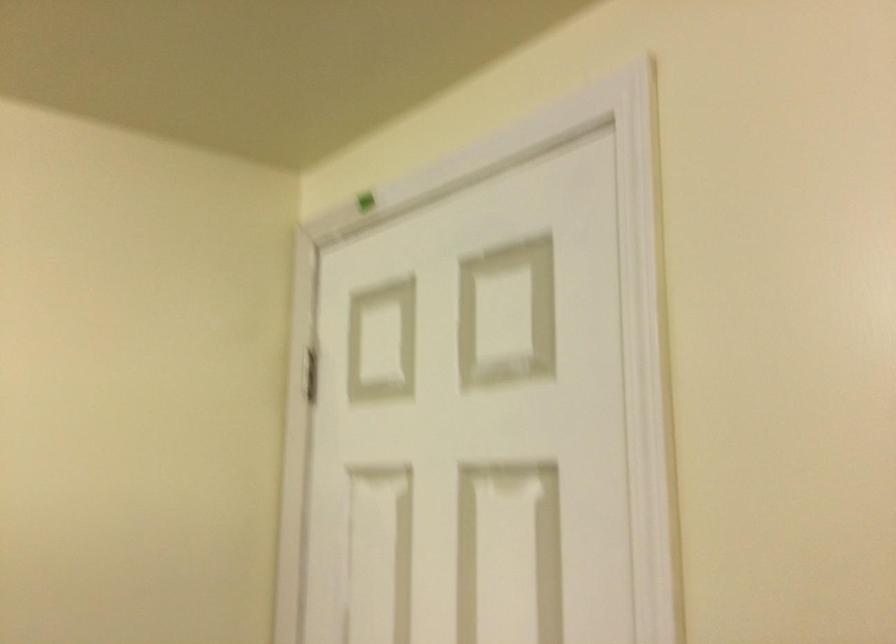
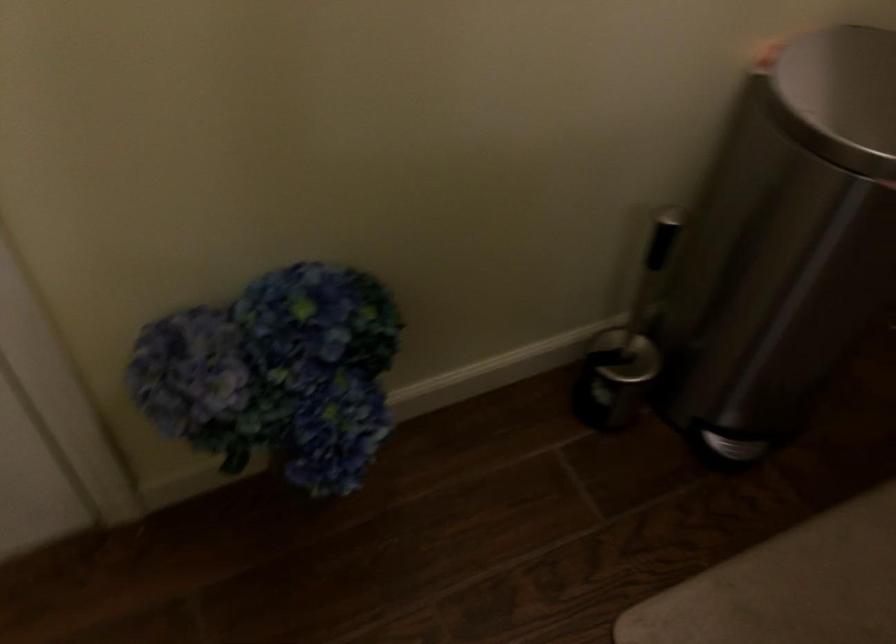
First-person continuous shooting, in which direction is the camera rotating?

The camera rotated toward right-down.